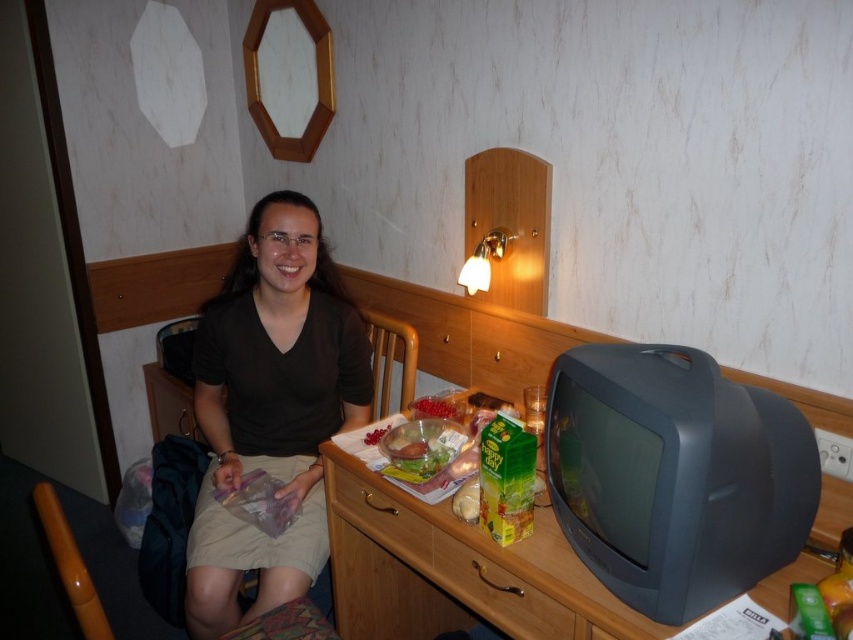
Is wooden drawer at lower center thinner than translucent plastic bag at center?

In fact, wooden drawer at lower center might be wider than translucent plastic bag at center.

Can you confirm if wooden drawer at lower center is taller than translucent plastic bag at center?

Yes, wooden drawer at lower center is taller than translucent plastic bag at center.

Does point (450, 560) come closer to viewer compared to point (421, 477)?

Yes.

This screenshot has height=640, width=853. Identify the location of wooden drawer at lower center. (421, 573).

Is wooden table at lower right to the left of wooden drawer at center from the viewer's perspective?

No, wooden table at lower right is not to the left of wooden drawer at center.

Who is more distant from viewer, [596,627] or [399,506]?

The point [399,506] is more distant.

I want to click on wooden table at lower right, so click(x=456, y=570).

Find the location of a particular element. wooden table at lower right is located at coordinates (456, 570).

How distant is matte black shirt at center from wooden drawer at center?

matte black shirt at center is 30.21 centimeters away from wooden drawer at center.

Is matte black shirt at center behind wooden drawer at center?

Yes, it is.

Describe the element at coordinates (271, 406) in the screenshot. This screenshot has height=640, width=853. I see `matte black shirt at center` at that location.

This screenshot has width=853, height=640. I want to click on matte black shirt at center, so 271,406.